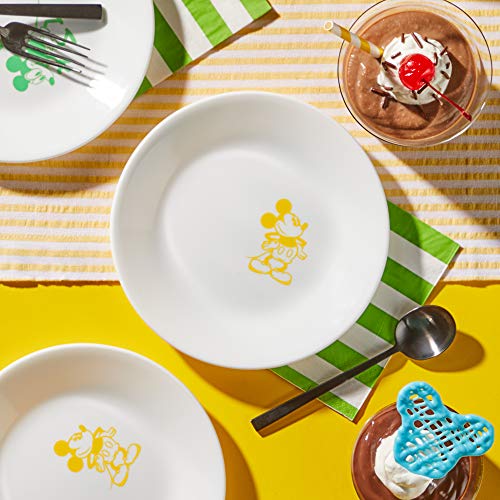
This screenshot has height=500, width=500. Find the location of `fork`. fork is located at coordinates (54, 51).